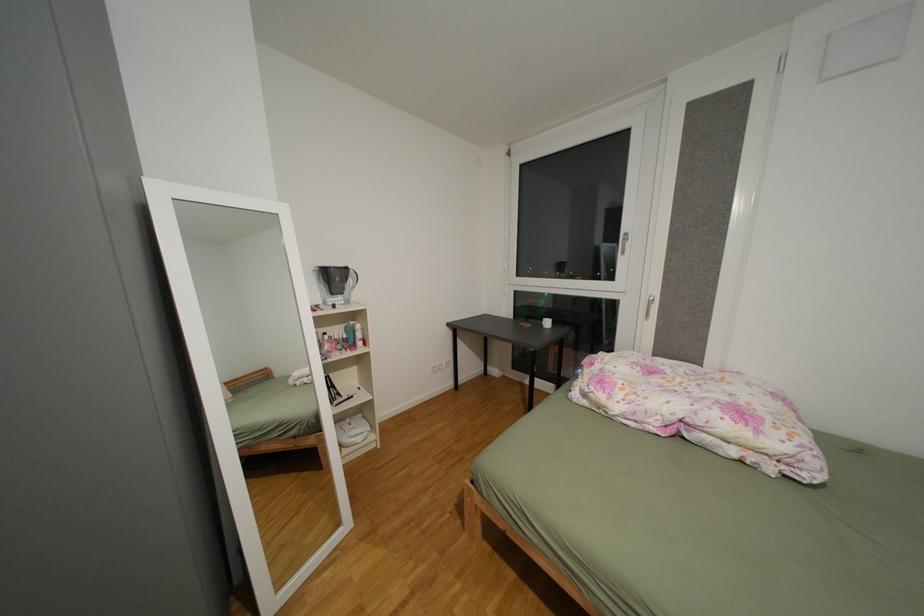
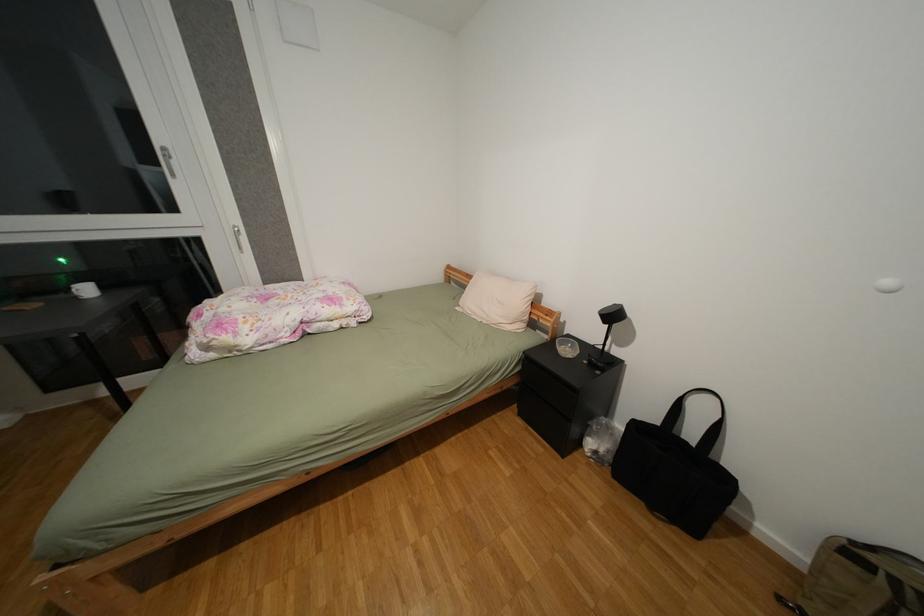
Based on the continuous images, in which direction is the camera rotating?

The camera's rotation is toward right-down.